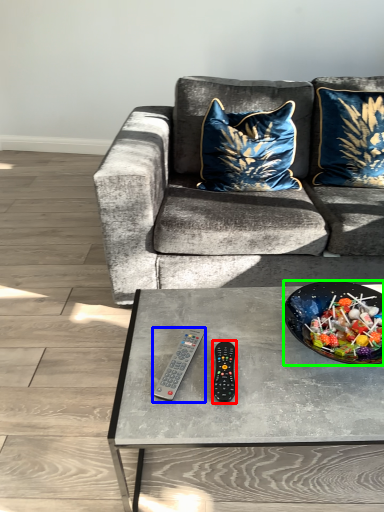
Question: Considering the real-world distances, which object is farthest from remote (highlighted by a red box)? remote control (highlighted by a blue box) or bowl (highlighted by a green box)?

Choices:
 (A) remote control
 (B) bowl

Answer: (B)